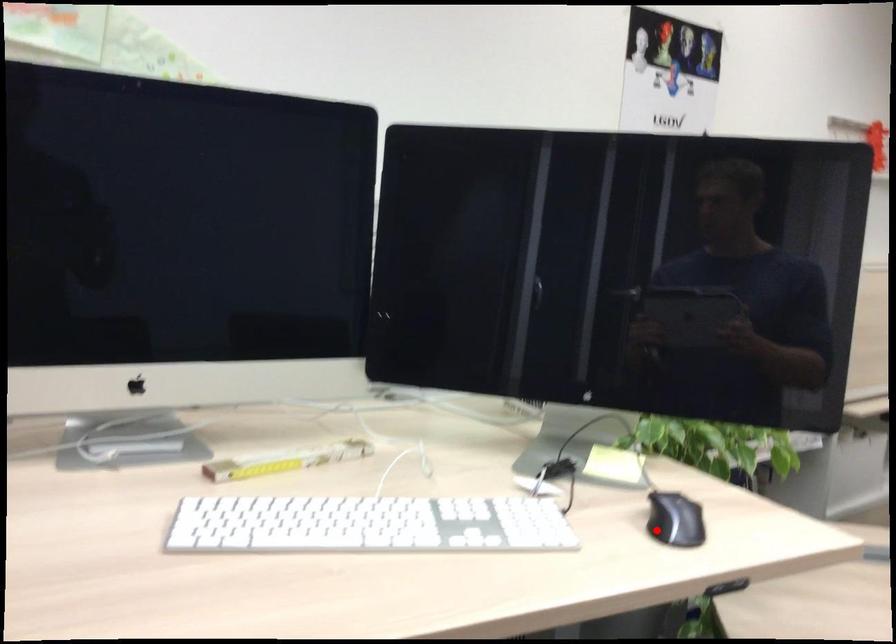
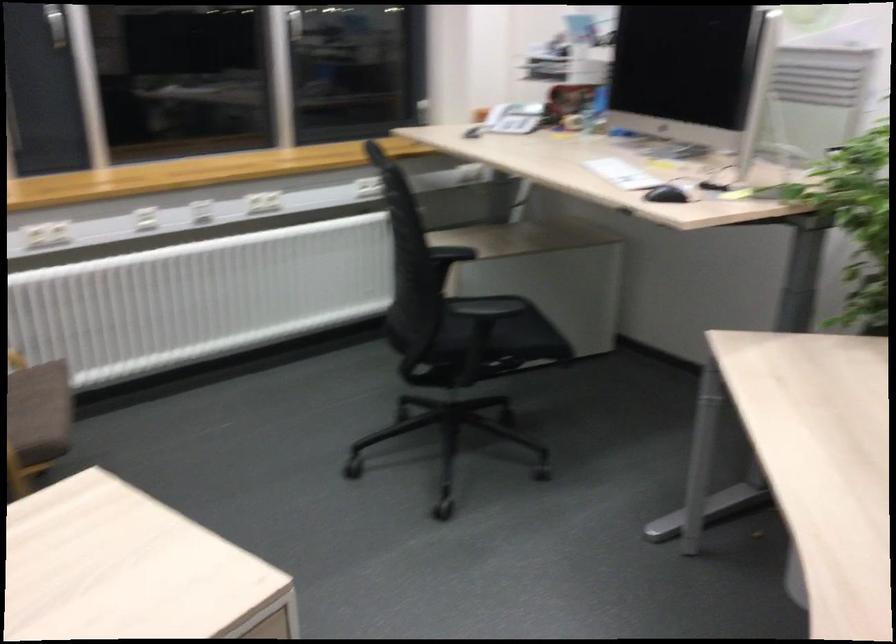
Question: I am providing you with two images of the same scene from different viewpoints. A red point is shown in image1. For the corresponding object point in image2, is it positioned nearer or farther from the camera?

Choices:
 (A) Nearer
 (B) Farther

Answer: (B)